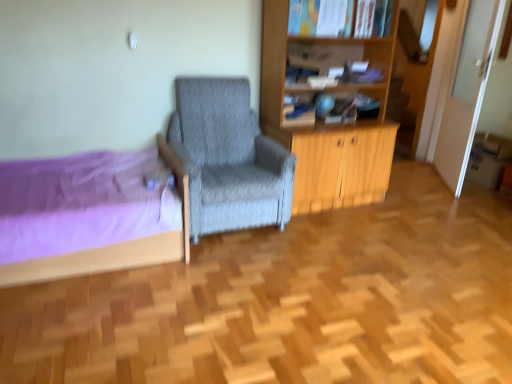
Question: Considering the relative positions of matte blue book at upper center, which is the 1th book in bottom-to-top order, and hardcover book at upper center, which ranks as the first book in right-to-left order, in the image provided, is matte blue book at upper center, which is the 1th book in bottom-to-top order, to the left of hardcover book at upper center, which ranks as the first book in right-to-left order, from the viewer's perspective?

Choices:
 (A) yes
 (B) no

Answer: (A)

Question: Is matte blue book at upper center, marked as the 2th book in a top-to-bottom arrangement, turned away from hardcover book at upper center, the 1th book from the top?

Choices:
 (A) no
 (B) yes

Answer: (A)

Question: Would you say matte blue book at upper center, marked as the 2th book in a top-to-bottom arrangement, is outside hardcover book at upper center, which is the 2th book from left to right?

Choices:
 (A) yes
 (B) no

Answer: (A)

Question: Is there a large distance between matte blue book at upper center, which is the 1th book in bottom-to-top order, and hardcover book at upper center, which ranks as the first book in right-to-left order?

Choices:
 (A) no
 (B) yes

Answer: (A)

Question: From the image's perspective, would you say matte blue book at upper center, the 2th book from the right, is shown under hardcover book at upper center, the 1th book from the top?

Choices:
 (A) yes
 (B) no

Answer: (A)

Question: Looking at their shapes, would you say matte blue book at upper center, which is the 1th book in bottom-to-top order, is wider or thinner than gray fabric chair at center?

Choices:
 (A) wide
 (B) thin

Answer: (B)

Question: In terms of size, does matte blue book at upper center, the 2th book from the right, appear bigger or smaller than gray fabric chair at center?

Choices:
 (A) small
 (B) big

Answer: (A)

Question: Is point (289, 122) positioned closer to the camera than point (274, 208)?

Choices:
 (A) farther
 (B) closer

Answer: (A)

Question: From a real-world perspective, is matte blue book at upper center, marked as the 2th book in a top-to-bottom arrangement, above or below gray fabric chair at center?

Choices:
 (A) above
 (B) below

Answer: (A)

Question: In terms of size, does gray fabric chair at center appear bigger or smaller than hardcover book at upper center, which ranks as the first book in right-to-left order?

Choices:
 (A) small
 (B) big

Answer: (B)

Question: Does point (238, 190) appear closer or farther from the camera than point (325, 6)?

Choices:
 (A) farther
 (B) closer

Answer: (B)

Question: Is gray fabric chair at center taller or shorter than hardcover book at upper center, the 2th book from the bottom?

Choices:
 (A) short
 (B) tall

Answer: (B)

Question: From a real-world perspective, is gray fabric chair at center above or below hardcover book at upper center, which is the 2th book from left to right?

Choices:
 (A) below
 (B) above

Answer: (A)

Question: Considering the positions of matte blue book at upper center, the 2th book from the right, and hardcover book at upper center, the 1th book from the top, in the image, is matte blue book at upper center, the 2th book from the right, bigger or smaller than hardcover book at upper center, the 1th book from the top,?

Choices:
 (A) small
 (B) big

Answer: (A)

Question: Is point (309, 107) positioned closer to the camera than point (289, 21)?

Choices:
 (A) farther
 (B) closer

Answer: (A)